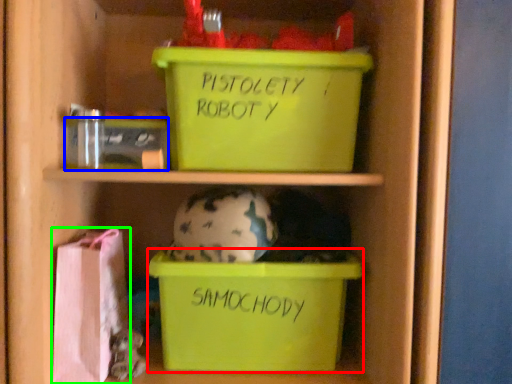
Question: Which object is positioned closest to storage box (highlighted by a red box)? Select from storage box (highlighted by a blue box) and material (highlighted by a green box).

Choices:
 (A) storage box
 (B) material

Answer: (B)